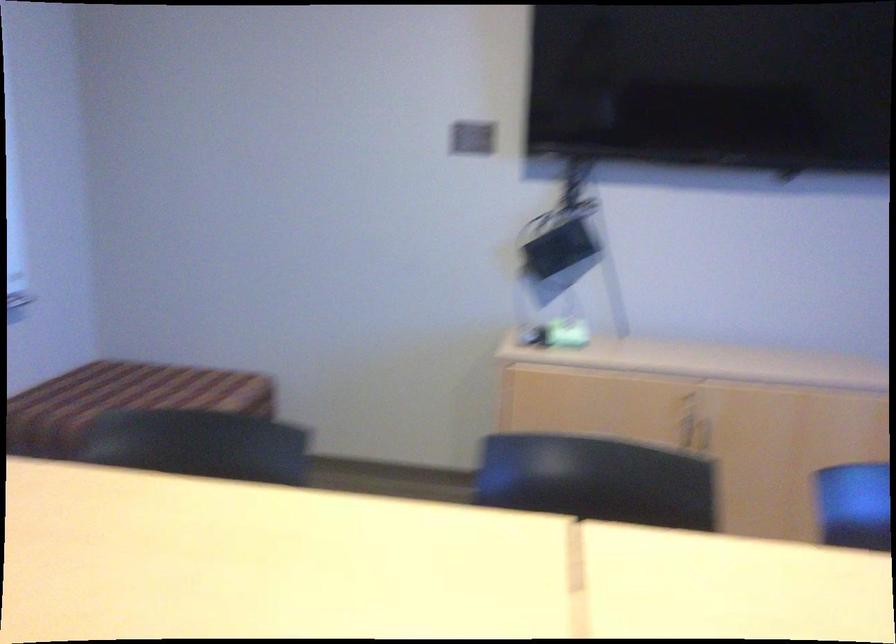
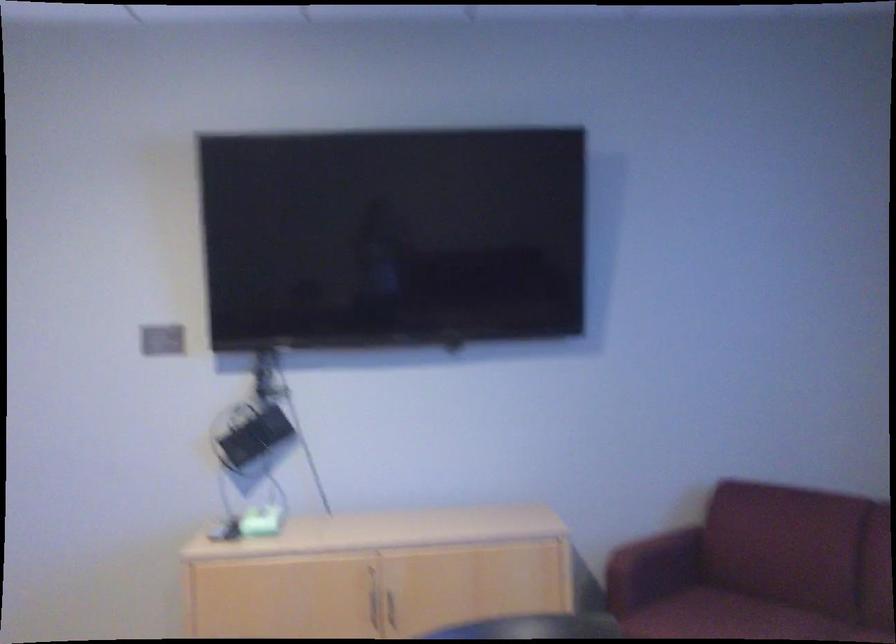
Find the pixel in the second image that matches pixel 681 430 in the first image.

(374, 607)